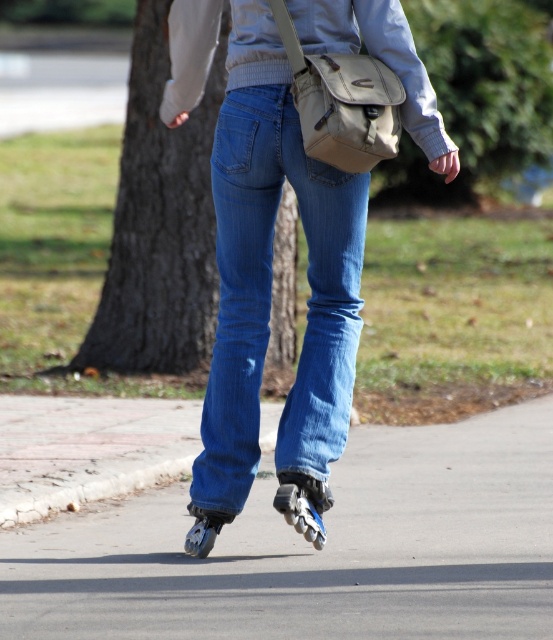
Question: Which of the following is the farthest from the observer?

Choices:
 (A) (158, 36)
 (B) (251, 170)
 (C) (336, 440)

Answer: (A)

Question: Which object is positioned closest to the light gray fleece sweatshirt at upper center?

Choices:
 (A) brown textured bark at center
 (B) shiny metallic roller skate at center
 (C) black rubber roller skate at center

Answer: (C)

Question: Which point is closer to the camera?

Choices:
 (A) (288, 416)
 (B) (205, 529)
 (C) (159, 520)
 (D) (301, 4)

Answer: (D)

Question: Can you confirm if smooth concrete at center is thinner than black rubber roller skate at center?

Choices:
 (A) yes
 (B) no

Answer: (B)

Question: Is brown textured bark at center smaller than shiny metallic roller skate at center?

Choices:
 (A) no
 (B) yes

Answer: (A)

Question: Is denim at center thinner than black rubber roller skate at center?

Choices:
 (A) yes
 (B) no

Answer: (B)